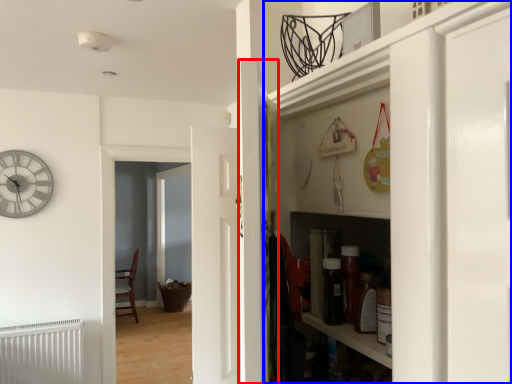
Question: Which point is further to the camera, door (highlighted by a red box) or cabinetry (highlighted by a blue box)?

Choices:
 (A) door
 (B) cabinetry

Answer: (A)